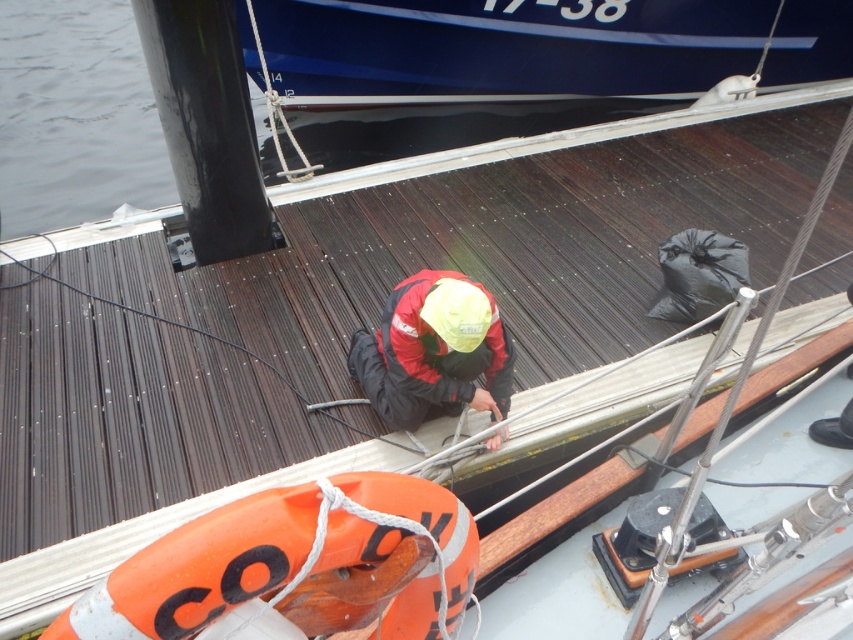
Does orange plastic life jacket at lower center appear on the right side of red matte jacket at center?

No, orange plastic life jacket at lower center is not to the right of red matte jacket at center.

Does point (381, 586) come in front of point (378, 392)?

Yes, point (381, 586) is closer to viewer.

Between point (247, 570) and point (360, 356), which one is positioned in front?

Point (247, 570) is in front.

Locate an element on the screen. orange plastic life jacket at lower center is located at coordinates (296, 566).